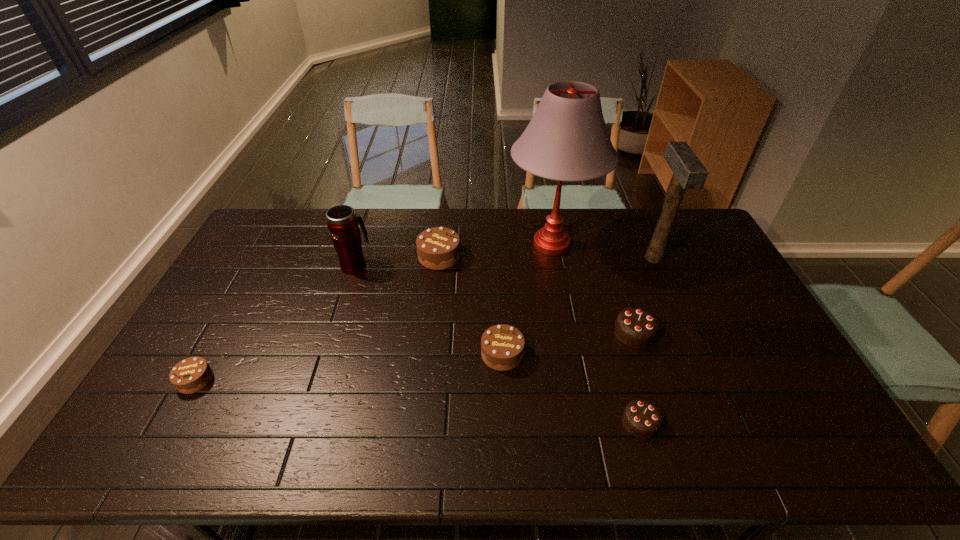
This screenshot has width=960, height=540. What are the coordinates of `object that is positioned at the near edge` in the screenshot? It's located at (641, 418).

Locate an element on the screen. This screenshot has width=960, height=540. object that is at the left edge is located at coordinates (192, 374).

Locate an element on the screen. The height and width of the screenshot is (540, 960). vacant region at the far edge of the desktop is located at coordinates (376, 238).

The height and width of the screenshot is (540, 960). In the image, there is a desktop. What are the coordinates of `free space at the near edge` in the screenshot? It's located at (372, 439).

Find the location of a particular element. free space at the left edge of the desktop is located at coordinates [232, 319].

In the image, there is a desktop. At what (x,y) coordinates should I click in order to perform the action: click on vacant area at the right edge. Please return your answer as a coordinate pair (x, y). The width and height of the screenshot is (960, 540). Looking at the image, I should click on (748, 326).

At what (x,y) coordinates should I click in order to perform the action: click on blank space at the far right corner of the desktop. Please return your answer as a coordinate pair (x, y). Looking at the image, I should click on (683, 220).

The width and height of the screenshot is (960, 540). In order to click on free spot between the mallet and the table lamp in this screenshot , I will do coord(603,251).

Locate an element on the screen. The width and height of the screenshot is (960, 540). vacant area that lies between the table lamp and the farther chocolate chocolate cake is located at coordinates (593, 288).

Locate an element on the screen. Image resolution: width=960 pixels, height=540 pixels. free space that is in between the table lamp and the farthest brown chocolate cake is located at coordinates (495, 251).